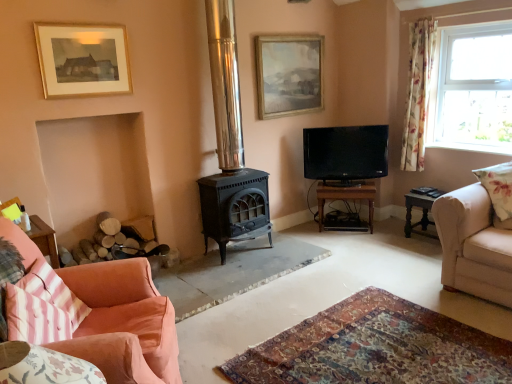
Where is `empty space that is ontop of wooden-framed painting at upper left, the 1th picture frame in the left-to-right sequence (from a real-world perspective)`? empty space that is ontop of wooden-framed painting at upper left, the 1th picture frame in the left-to-right sequence (from a real-world perspective) is located at coordinates (84, 22).